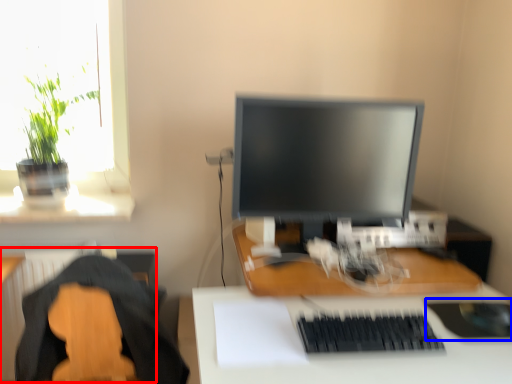
Question: Which of the following is the closest to the observer, radiator (highlighted by a red box) or mousepad (highlighted by a blue box)?

Choices:
 (A) radiator
 (B) mousepad

Answer: (A)